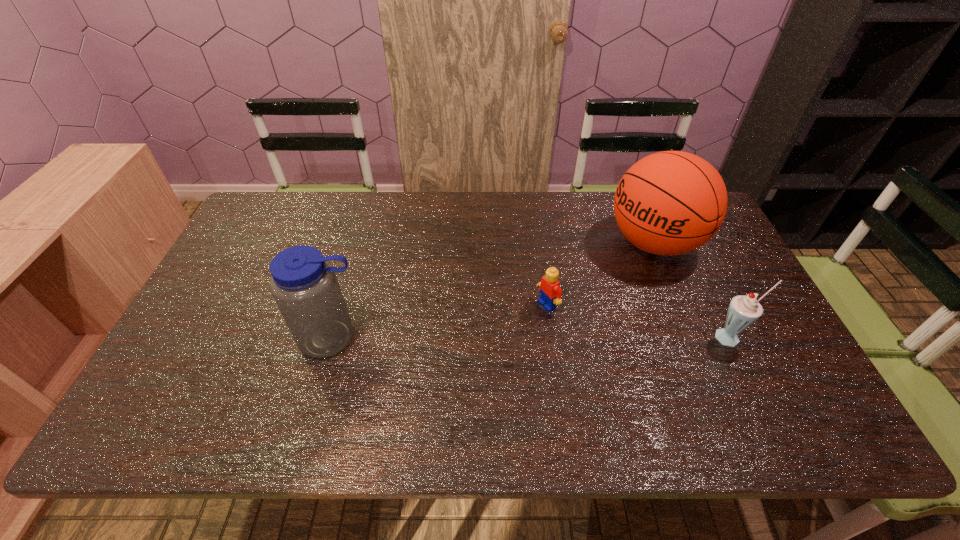
Where is `free location at the right edge`? free location at the right edge is located at coordinates (724, 294).

Image resolution: width=960 pixels, height=540 pixels. In the image, there is a desktop. Find the location of `free space at the far left corner`. free space at the far left corner is located at coordinates (257, 208).

The image size is (960, 540). Find the location of `unoccupied area between the water bottle and the farthest object`. unoccupied area between the water bottle and the farthest object is located at coordinates (493, 291).

I want to click on free space between the leftmost object and the basketball, so click(x=493, y=291).

This screenshot has width=960, height=540. What are the coordinates of `free spot between the farthest object and the leftmost object` in the screenshot? It's located at (493, 291).

This screenshot has height=540, width=960. What are the coordinates of `vacant space that is in between the second shortest object and the basketball` in the screenshot? It's located at [x=693, y=290].

Locate an element on the screen. Image resolution: width=960 pixels, height=540 pixels. vacant point located between the milkshake and the water bottle is located at coordinates pos(533,338).

You are a GUI agent. You are given a task and a screenshot of the screen. Output one action in this format:
    pyautogui.click(x=<x>, y=<y>)
    Task: Click on the free point between the leftmost object and the shortest object
    
    Given the screenshot: What is the action you would take?
    pyautogui.click(x=440, y=321)

Find the location of a particular element. The height and width of the screenshot is (540, 960). free area in between the water bottle and the Lego is located at coordinates (440, 321).

Where is `empty location between the milkshake and the shortest object`? empty location between the milkshake and the shortest object is located at coordinates (639, 321).